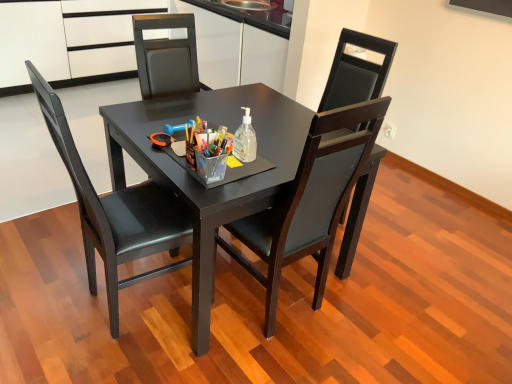
Question: Should I look upward or downward to see matte black table at center?

Choices:
 (A) down
 (B) up

Answer: (A)

Question: Is clear plastic bottle at center touching matte black chair at center, which is the 2th chair from left to right?

Choices:
 (A) yes
 (B) no

Answer: (B)

Question: From a real-world perspective, is clear plastic bottle at center positioned under matte black chair at center, placed as the 1th chair when sorted from right to left, based on gravity?

Choices:
 (A) yes
 (B) no

Answer: (B)

Question: Considering the relative sizes of clear plastic bottle at center and matte black chair at center, placed as the 1th chair when sorted from right to left, in the image provided, is clear plastic bottle at center smaller than matte black chair at center, placed as the 1th chair when sorted from right to left,?

Choices:
 (A) yes
 (B) no

Answer: (A)

Question: Is matte black chair at center, placed as the 1th chair when sorted from right to left, at the back of clear plastic bottle at center?

Choices:
 (A) no
 (B) yes

Answer: (B)

Question: From the image's perspective, is clear plastic bottle at center above matte black chair at center, which is the 2th chair from left to right?

Choices:
 (A) no
 (B) yes

Answer: (B)

Question: Could matte black chair at center, placed as the 1th chair when sorted from right to left, be considered to be inside clear plastic bottle at center?

Choices:
 (A) yes
 (B) no

Answer: (B)

Question: Does white matte cabinet at upper left lie behind matte black chair at center, marked as the 2th chair in a right-to-left arrangement?

Choices:
 (A) yes
 (B) no

Answer: (A)

Question: Can you confirm if white matte cabinet at upper left is positioned to the left of matte black chair at center, marked as the 2th chair in a right-to-left arrangement?

Choices:
 (A) yes
 (B) no

Answer: (A)

Question: Does white matte cabinet at upper left have a greater height compared to matte black chair at center, marked as the 2th chair in a right-to-left arrangement?

Choices:
 (A) no
 (B) yes

Answer: (A)

Question: Is white matte cabinet at upper left beside matte black chair at center, which ranks as the 1th chair in left-to-right order?

Choices:
 (A) no
 (B) yes

Answer: (A)

Question: Does white matte cabinet at upper left have a larger size compared to matte black chair at center, which ranks as the 1th chair in left-to-right order?

Choices:
 (A) yes
 (B) no

Answer: (A)

Question: From a real-world perspective, is white matte cabinet at upper left over matte black chair at center, marked as the 2th chair in a right-to-left arrangement?

Choices:
 (A) yes
 (B) no

Answer: (B)

Question: From a real-world perspective, is white matte cabinet at upper left under matte black chair at center, which is the 2th chair from left to right?

Choices:
 (A) yes
 (B) no

Answer: (A)